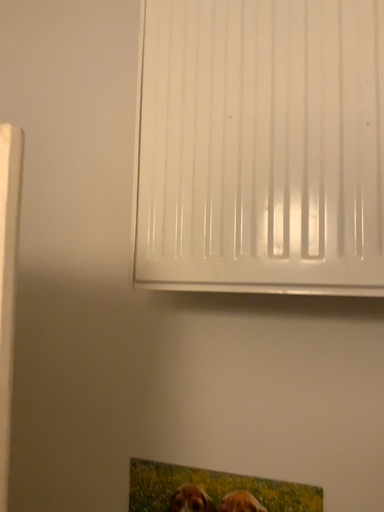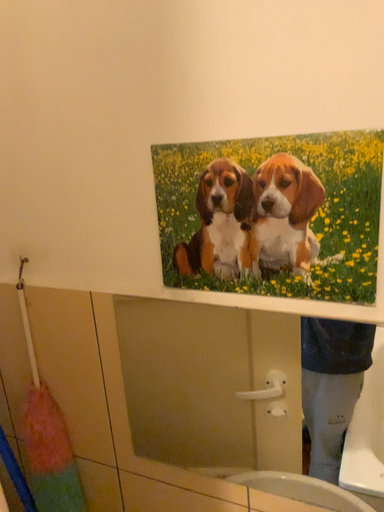
Question: Which way did the camera rotate in the video?

Choices:
 (A) rotated downward
 (B) rotated upward

Answer: (A)